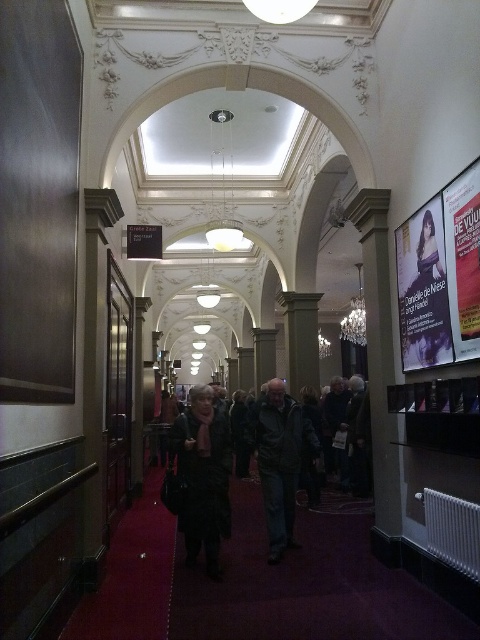
Who is taller, dark gray wool coat at center or matte white poster at right?

matte white poster at right

Does point (189, 544) lie in front of point (424, 230)?

That is False.

I want to click on dark gray wool coat at center, so click(x=203, y=476).

Based on the photo, measure the distance between dark gray coat at center and matte white poster at right.

dark gray coat at center is 2.38 meters away from matte white poster at right.

Does point (292, 531) come farther from viewer compared to point (440, 346)?

Yes, it is.

Between point (178, 445) and point (432, 259), which one is positioned behind?

The point (178, 445) is behind.

The width and height of the screenshot is (480, 640). What are the coordinates of `dark gray coat at center` in the screenshot? It's located at (201, 477).

Who is positioned more to the right, dark gray coat at center or dark gray wool coat at center?

From the viewer's perspective, dark gray wool coat at center appears more on the right side.

Does dark gray coat at center have a greater height compared to dark gray wool coat at center?

Indeed, dark gray coat at center has a greater height compared to dark gray wool coat at center.

You are a GUI agent. You are given a task and a screenshot of the screen. Output one action in this format:
    pyautogui.click(x=<x>, y=<y>)
    Task: Click on the dark gray coat at center
    This screenshot has height=640, width=480.
    Given the screenshot: What is the action you would take?
    pyautogui.click(x=201, y=477)